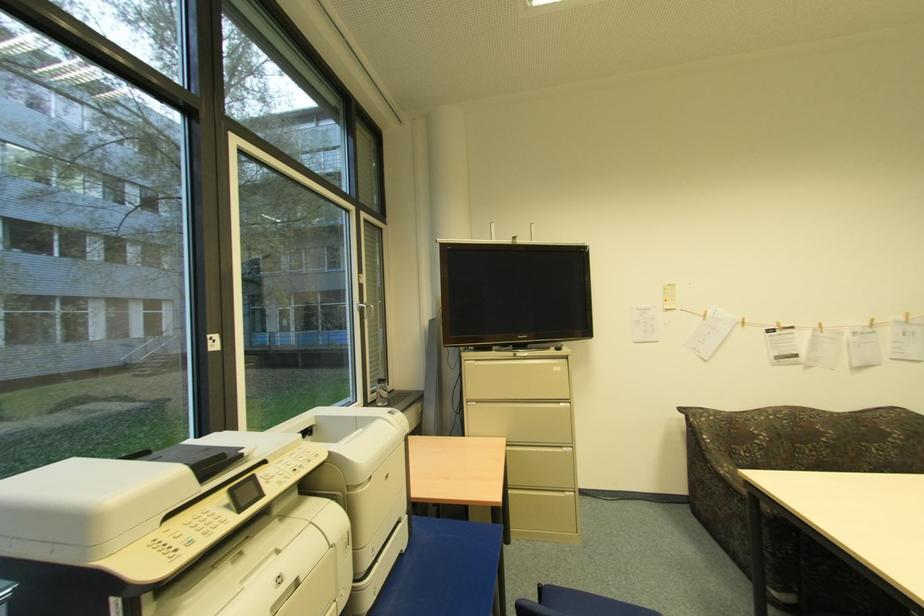
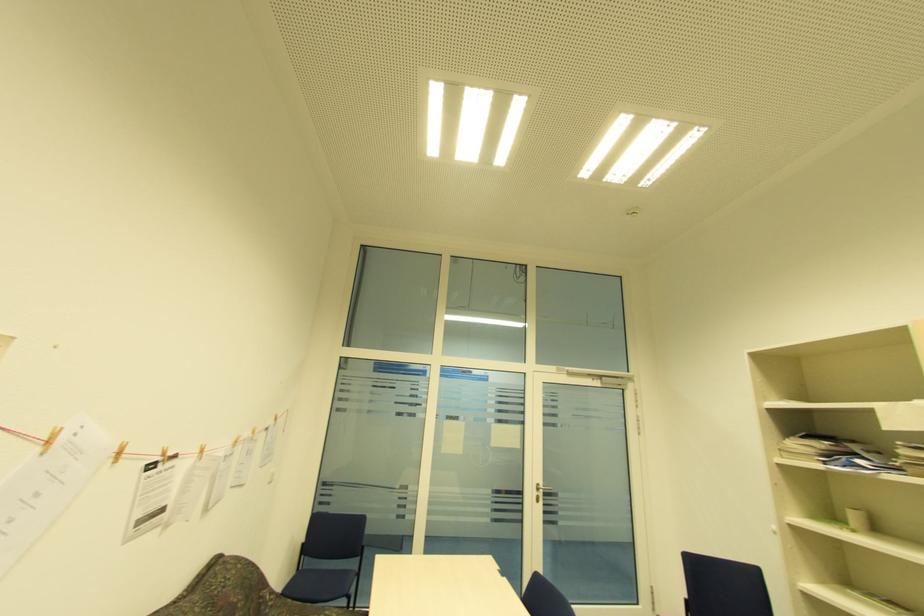
Where in the second image is the point corresponding to point (822, 328) from the first image?

(203, 453)